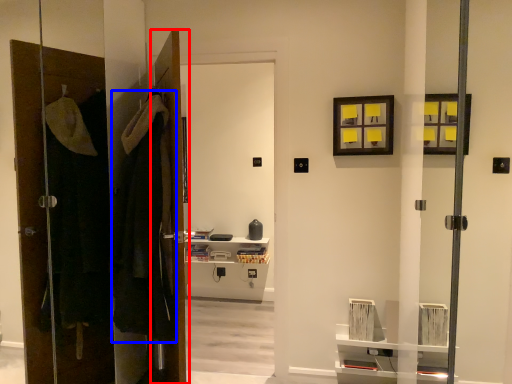
Question: Which object appears closest to the camera in this image, door (highlighted by a red box) or robe (highlighted by a blue box)?

Choices:
 (A) door
 (B) robe

Answer: (B)